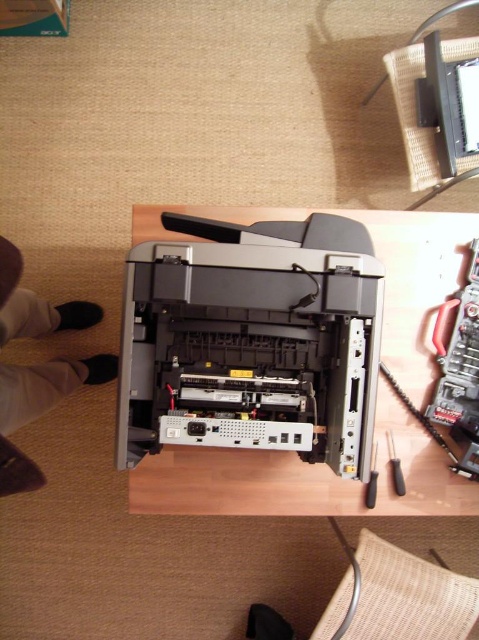
Question: Where is black plastic printer at center located in relation to black plastic screwdriver at lower right in the image?

Choices:
 (A) below
 (B) above

Answer: (B)

Question: Which point is closer to the camera taking this photo?

Choices:
 (A) (43, 477)
 (B) (285, 310)

Answer: (B)

Question: Among these objects, which one is farthest from the camera?

Choices:
 (A) white fabric pants at lower left
 (B) black plastic screwdriver at lower right

Answer: (B)

Question: Is black plastic printer at center positioned behind white fabric pants at lower left?

Choices:
 (A) no
 (B) yes

Answer: (A)

Question: Which point is closer to the camera?

Choices:
 (A) black plastic printer at center
 (B) black plastic screwdriver at lower right
 (C) black plastic screwdriver at center

Answer: (A)

Question: Does black plastic screwdriver at lower right lie in front of black plastic screwdriver at center?

Choices:
 (A) yes
 (B) no

Answer: (B)